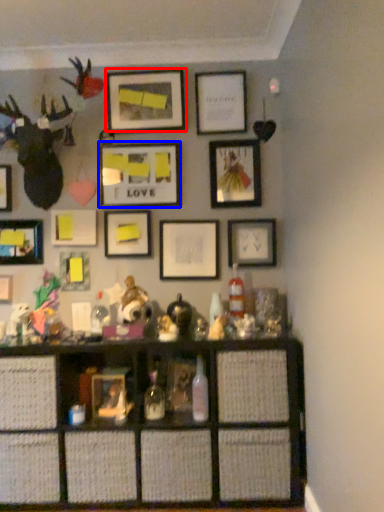
Question: Which object is further to the camera taking this photo, picture frame (highlighted by a red box) or picture frame (highlighted by a blue box)?

Choices:
 (A) picture frame
 (B) picture frame

Answer: (B)